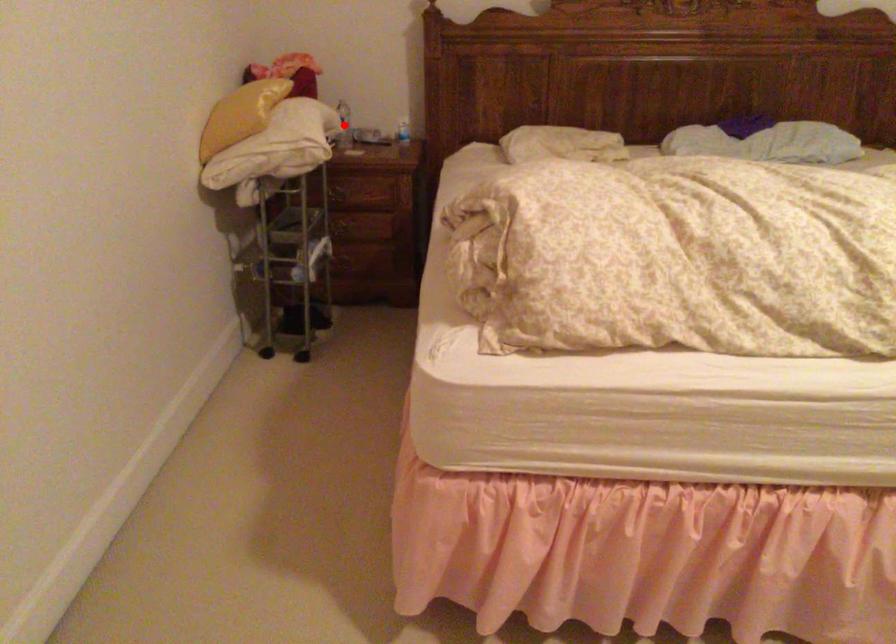
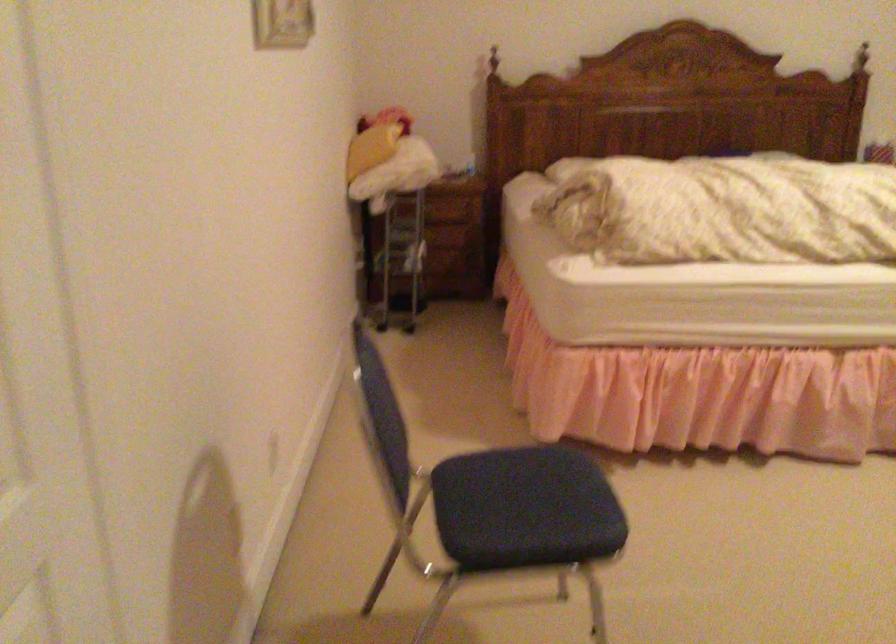
Question: I am providing you with two images of the same scene from different viewpoints. A red point is marked on the first image. Can you still see the location of the red point in image 2?

Choices:
 (A) Yes
 (B) No

Answer: (B)